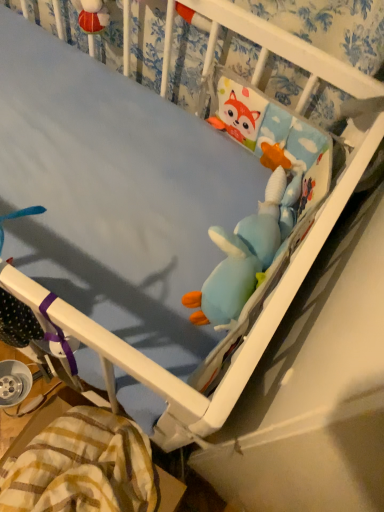
Question: Does blue plush toy at center, the 1th toy in the bottom-to-top sequence, have a lesser width compared to yellow plaid blanket at lower left?

Choices:
 (A) yes
 (B) no

Answer: (A)

Question: Can you confirm if blue plush toy at center, the 1th toy in the bottom-to-top sequence, is taller than yellow plaid blanket at lower left?

Choices:
 (A) yes
 (B) no

Answer: (B)

Question: Is blue plush toy at center, which is counted as the second toy, starting from the top, shorter than yellow plaid blanket at lower left?

Choices:
 (A) no
 (B) yes

Answer: (B)

Question: Does blue plush toy at center, the 1th toy in the bottom-to-top sequence, contain yellow plaid blanket at lower left?

Choices:
 (A) no
 (B) yes

Answer: (A)

Question: Is blue plush toy at center, which is counted as the second toy, starting from the top, facing towards yellow plaid blanket at lower left?

Choices:
 (A) yes
 (B) no

Answer: (B)

Question: Considering the relative positions of soft plush toy at upper right, acting as the 2th toy starting from the bottom, and yellow plaid blanket at lower left in the image provided, is soft plush toy at upper right, acting as the 2th toy starting from the bottom, to the left or to the right of yellow plaid blanket at lower left?

Choices:
 (A) left
 (B) right

Answer: (B)

Question: Do you think soft plush toy at upper right, which ranks as the first toy in top-to-bottom order, is within yellow plaid blanket at lower left, or outside of it?

Choices:
 (A) outside
 (B) inside

Answer: (A)

Question: Considering the positions of soft plush toy at upper right, acting as the 2th toy starting from the bottom, and yellow plaid blanket at lower left in the image, is soft plush toy at upper right, acting as the 2th toy starting from the bottom, bigger or smaller than yellow plaid blanket at lower left?

Choices:
 (A) big
 (B) small

Answer: (B)

Question: In the image, is soft plush toy at upper right, which ranks as the first toy in top-to-bottom order, positioned in front of or behind yellow plaid blanket at lower left?

Choices:
 (A) behind
 (B) front

Answer: (A)

Question: Is point (215, 238) closer or farther from the camera than point (286, 159)?

Choices:
 (A) farther
 (B) closer

Answer: (B)

Question: Based on their positions, is blue plush toy at center, which is counted as the second toy, starting from the top, located to the left or right of soft plush toy at upper right, acting as the 2th toy starting from the bottom?

Choices:
 (A) right
 (B) left

Answer: (B)

Question: Based on their sizes in the image, would you say blue plush toy at center, the 1th toy in the bottom-to-top sequence, is bigger or smaller than soft plush toy at upper right, acting as the 2th toy starting from the bottom?

Choices:
 (A) big
 (B) small

Answer: (A)

Question: From the image's perspective, is blue plush toy at center, which is counted as the second toy, starting from the top, positioned above or below soft plush toy at upper right, acting as the 2th toy starting from the bottom?

Choices:
 (A) below
 (B) above

Answer: (A)

Question: In terms of width, does yellow plaid blanket at lower left look wider or thinner when compared to blue plush toy at center, which is counted as the second toy, starting from the top?

Choices:
 (A) thin
 (B) wide

Answer: (B)

Question: From a real-world perspective, is yellow plaid blanket at lower left positioned above or below blue plush toy at center, which is counted as the second toy, starting from the top?

Choices:
 (A) below
 (B) above

Answer: (A)